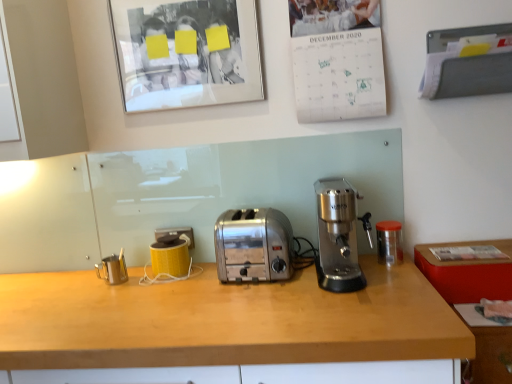
Where is `empty space that is ontop of wooden countertop at lower right (from a real-world perspective)`? This screenshot has height=384, width=512. empty space that is ontop of wooden countertop at lower right (from a real-world perspective) is located at coordinates (486, 308).